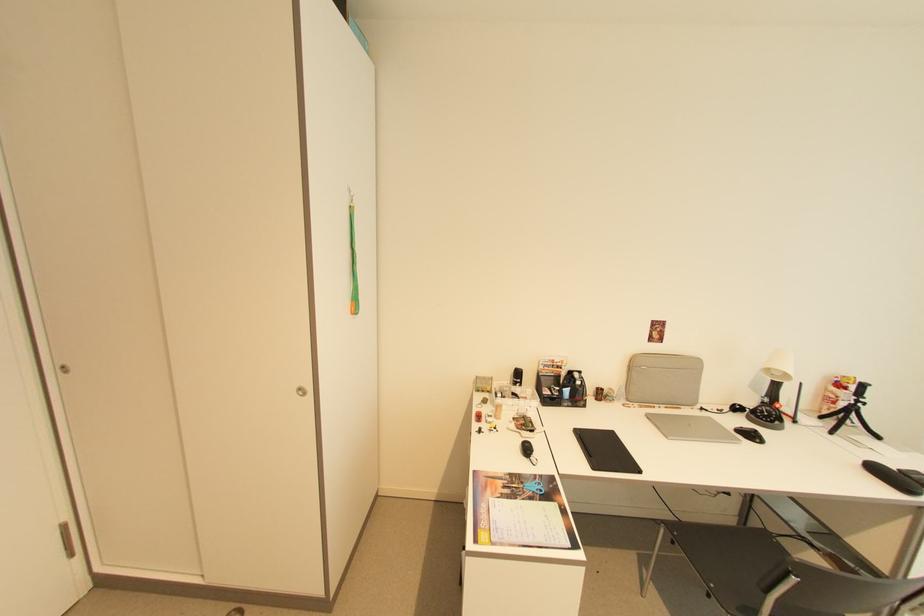
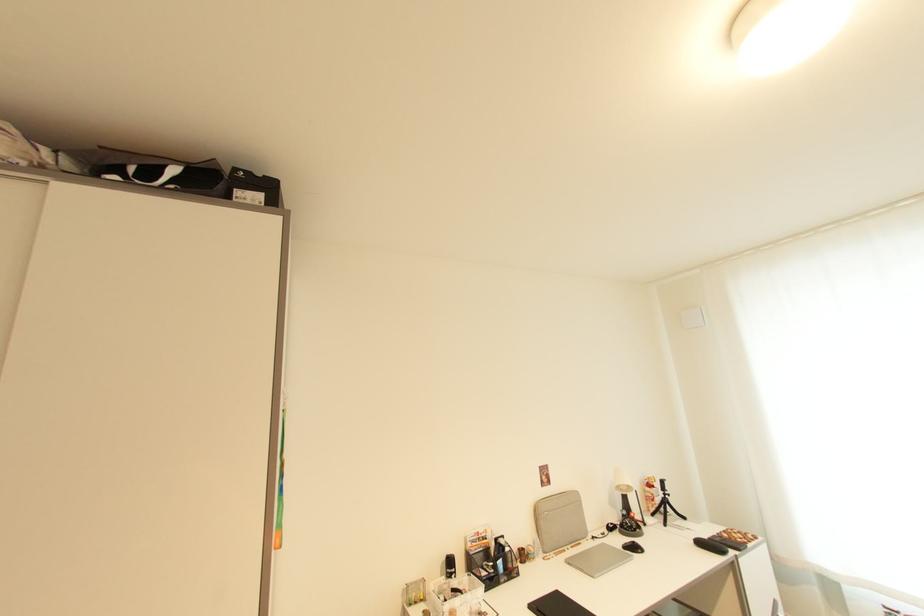
In the second image, find the point that corresponds to (756,437) in the first image.

(639, 549)